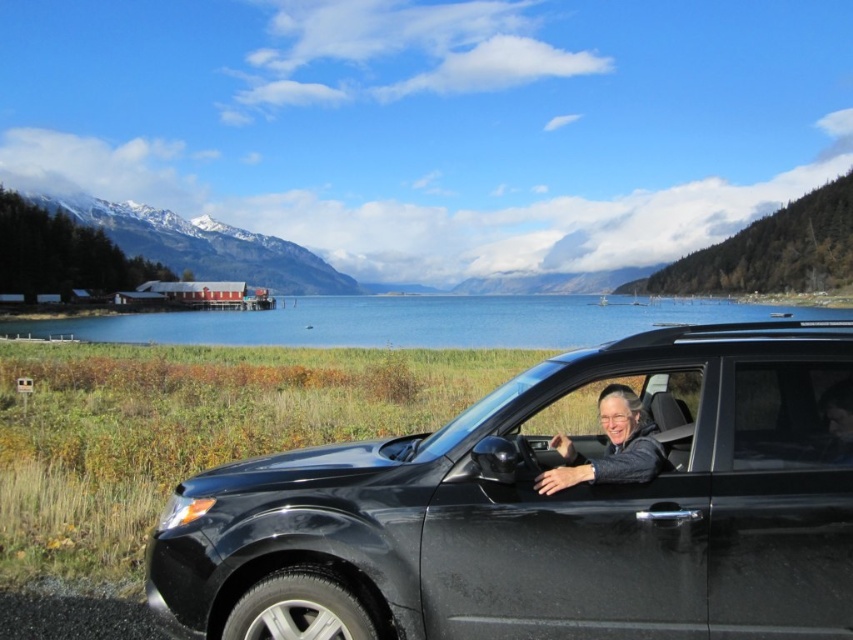
Based on the photo, can you confirm if transparent glass window at center is shorter than matte gray car door at center?

Yes, transparent glass window at center is shorter than matte gray car door at center.

Which is in front, point (759, 371) or point (550, 468)?

Point (759, 371) is in front.

Locate an element on the screen. The height and width of the screenshot is (640, 853). transparent glass window at center is located at coordinates click(x=792, y=416).

The image size is (853, 640). Find the location of `blue water at center`. blue water at center is located at coordinates (413, 321).

The height and width of the screenshot is (640, 853). What do you see at coordinates (413, 321) in the screenshot? I see `blue water at center` at bounding box center [413, 321].

Image resolution: width=853 pixels, height=640 pixels. Describe the element at coordinates (413, 321) in the screenshot. I see `blue water at center` at that location.

Locate an element on the screen. blue water at center is located at coordinates (413, 321).

Is glossy black suv at lower right further to the viewer compared to blue water at center?

That is False.

Does glossy black suv at lower right appear under blue water at center?

Yes, glossy black suv at lower right is below blue water at center.

Between point (711, 340) and point (540, 336), which one is positioned behind?

The point (540, 336) is more distant.

Locate an element on the screen. The image size is (853, 640). glossy black suv at lower right is located at coordinates (549, 508).